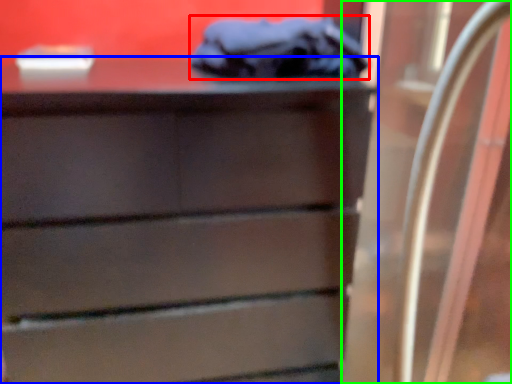
Question: Which object is positioned closest to scrub (highlighted by a red box)? Select from chest of drawers (highlighted by a blue box) and glass door (highlighted by a green box).

Choices:
 (A) chest of drawers
 (B) glass door

Answer: (A)